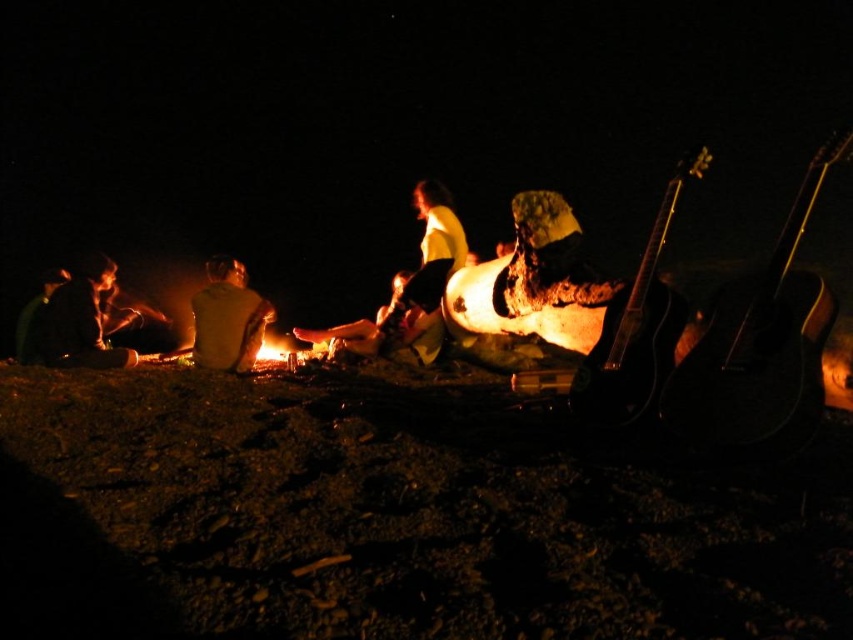
Question: Is charcoal gray firewood at lower left smaller than yellow fabric shirt at center?

Choices:
 (A) yes
 (B) no

Answer: (B)

Question: Which point is farther to the camera?

Choices:
 (A) (111, 268)
 (B) (225, 272)

Answer: (A)

Question: Which object is farther from the camera taking this photo?

Choices:
 (A) charcoal gray firewood at lower left
 (B) yellow fabric shirt at center

Answer: (B)

Question: Is charcoal gray firewood at lower left below yellow fabric shirt at center?

Choices:
 (A) yes
 (B) no

Answer: (B)

Question: Considering the relative positions of charcoal gray firewood at lower left and yellow fabric shirt at center in the image provided, where is charcoal gray firewood at lower left located with respect to yellow fabric shirt at center?

Choices:
 (A) below
 (B) above

Answer: (B)